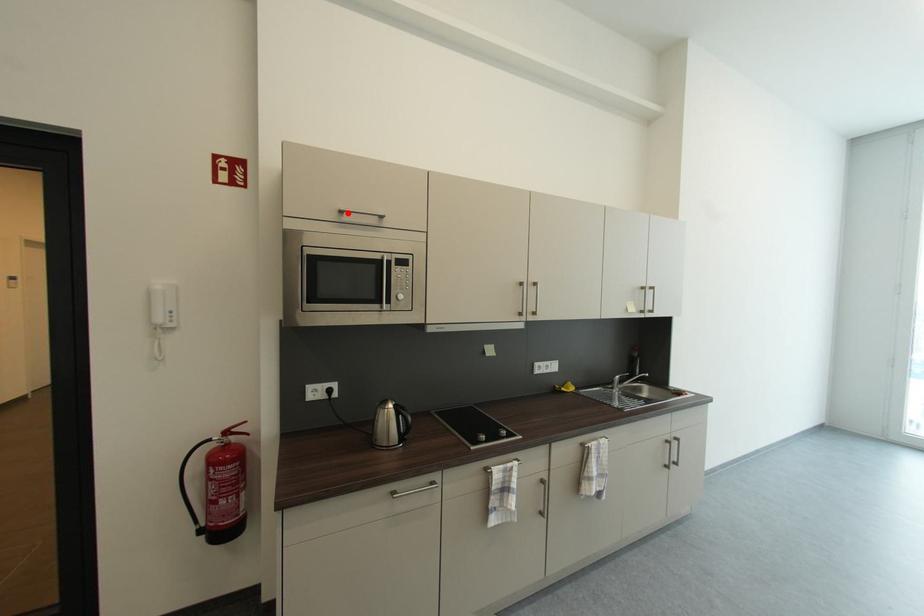
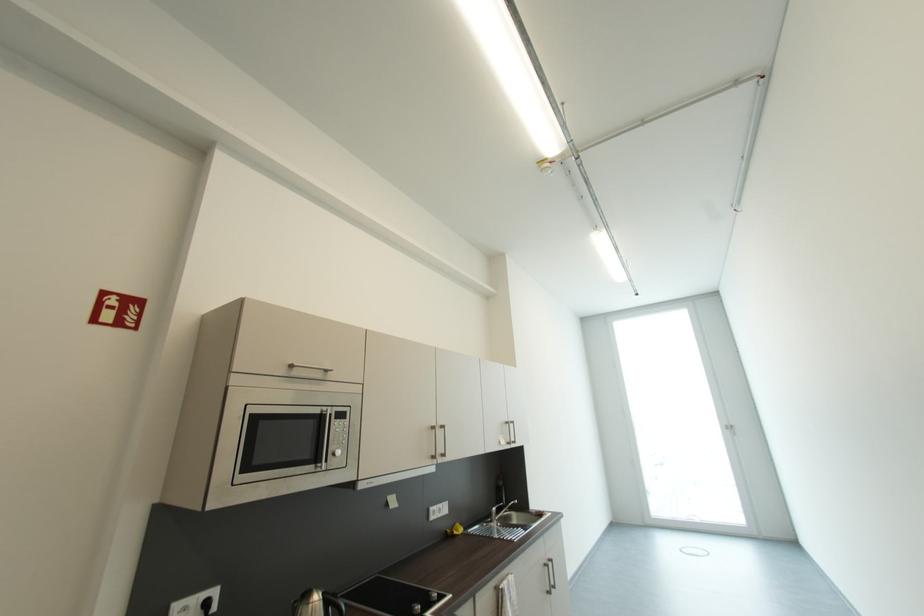
In the second image, find the point that corresponds to the highlighted location in the first image.

(298, 368)